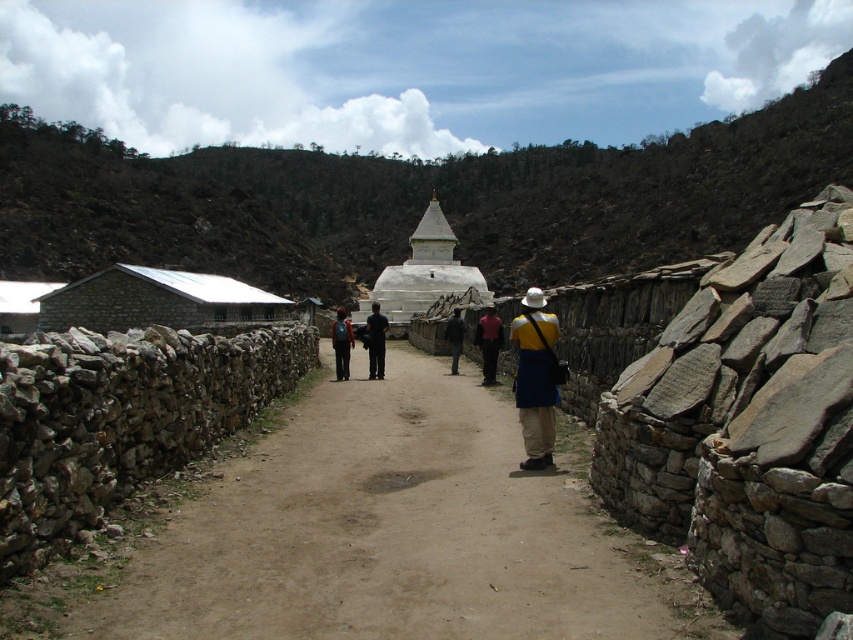
Does dirt path at center come behind dark blue fabric at center?

No, dirt path at center is in front of dark blue fabric at center.

Is point (651, 600) less distant than point (456, 344)?

Yes, point (651, 600) is in front of point (456, 344).

Find the location of a particular element. The width and height of the screenshot is (853, 640). dirt path at center is located at coordinates (395, 532).

Can you confirm if white stone stupa at center is smaller than black fabric backpack at center?

No.

Which is behind, point (358, 304) or point (341, 374)?

Point (358, 304)

Who is more forward, (x=444, y=284) or (x=347, y=378)?

Point (x=347, y=378) is more forward.

The width and height of the screenshot is (853, 640). In order to click on white stone stupa at center in this screenshot , I will do `click(425, 275)`.

Is point (521, 342) positioned in front of point (376, 310)?

Yes, point (521, 342) is closer to viewer.

Between yellow fabric at center and black fabric pants at center, which one appears on the left side from the viewer's perspective?

black fabric pants at center is more to the left.

Based on the photo, who is more distant from viewer, (527, 440) or (364, 340)?

Point (364, 340)

Identify the location of yellow fabric at center. (535, 378).